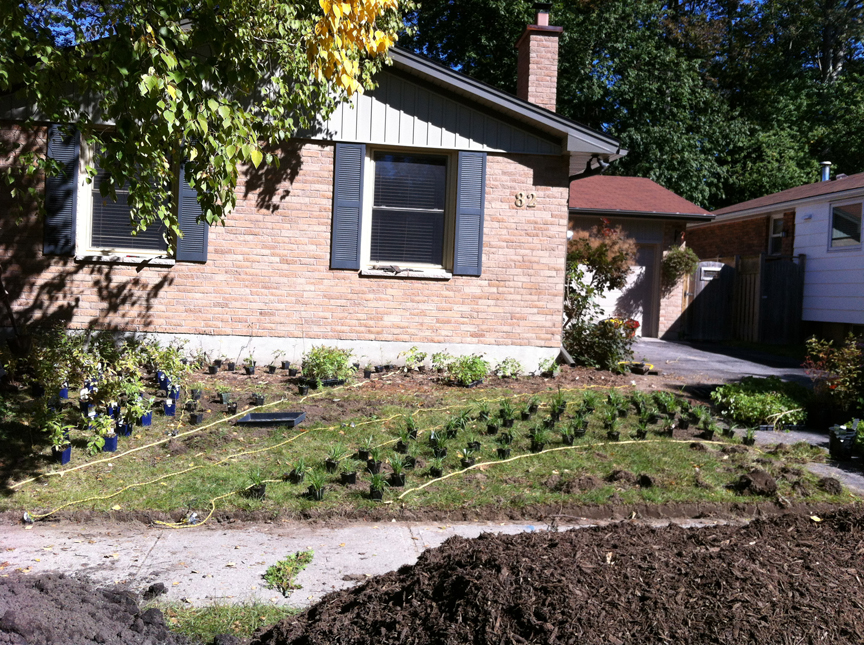
I want to click on hanging basket, so click(x=676, y=255).